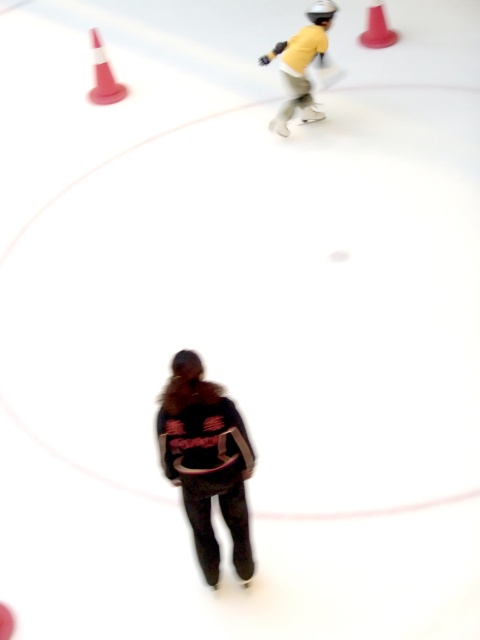
You are at the ice skating rink and want to place your yellow matte skateboard at upper center on the rink. Given the rink has red boundary lines, can you confirm if the skateboard is within the skating area?

The yellow matte skateboard at upper center is located at point (x=301, y=65). Since the rink has red boundary lines, but the exact coordinates of the boundaries are not provided, it is uncertain if the skateboard is within the skating area. Please check the rink boundaries to confirm.

You are at an ice skating rink and want to place your yellow matte skateboard at upper center near the smooth plastic cone at upper right. Based on their positions, which object is located to the left of the other?

The yellow matte skateboard at upper center is positioned on the left side of smooth plastic cone at upper right.

You are a photographer trying to capture a clear shot of the dark brown leather jacket at center. The image you took is slightly blurred. Based on the coordinates provided, can you determine if the jacket is in focus or out of focus?

The dark brown leather jacket at center is positioned at coordinates point (206,461), which is the center of the image. Since the image is slightly blurred due to motion or a quick snapshot, the jacket may be out of focus.